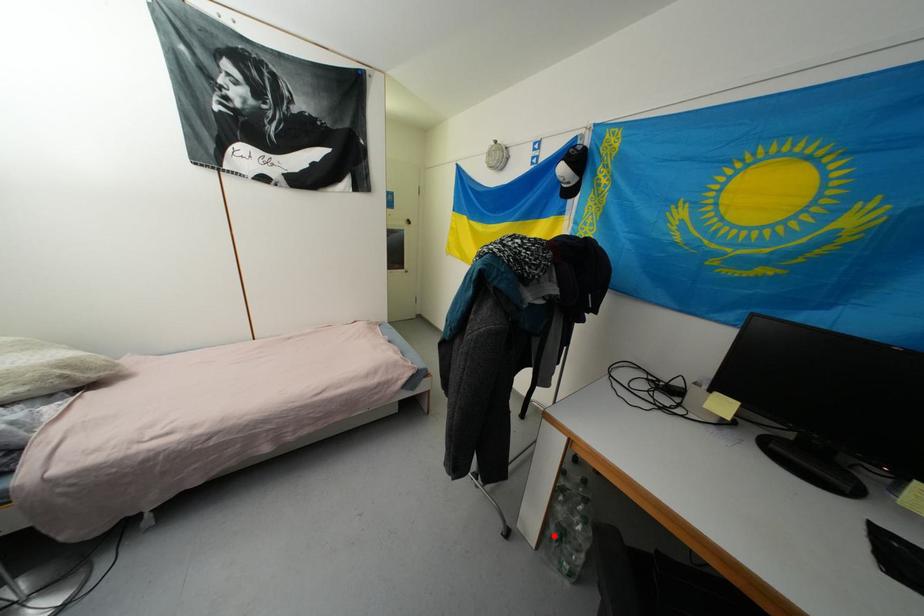
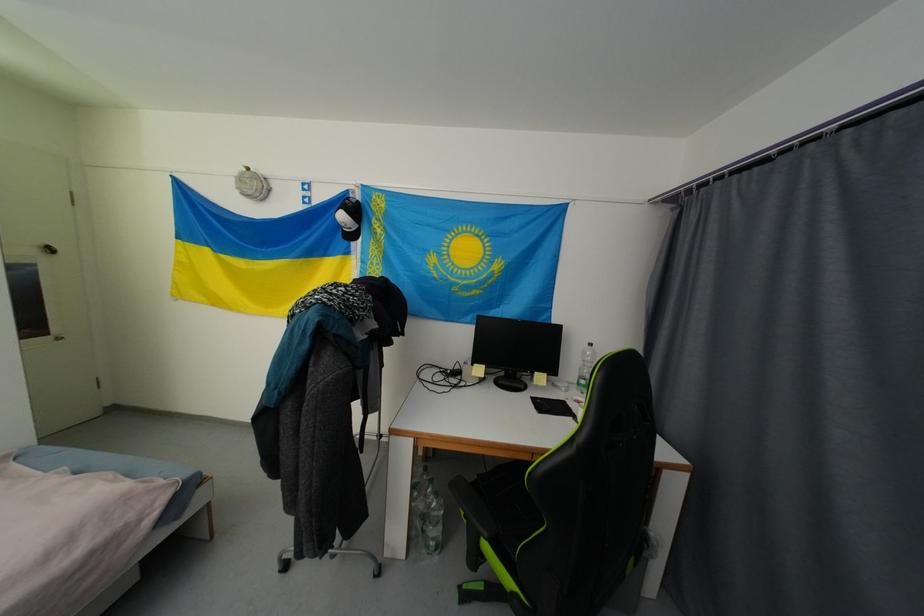
Question: A red point is marked in image1. In image2, is the corresponding 3D point closer to the camera or farther? Reply with the corresponding letter.

Choices:
 (A) The corresponding 3D point is closer.
 (B) The corresponding 3D point is farther.

Answer: (B)